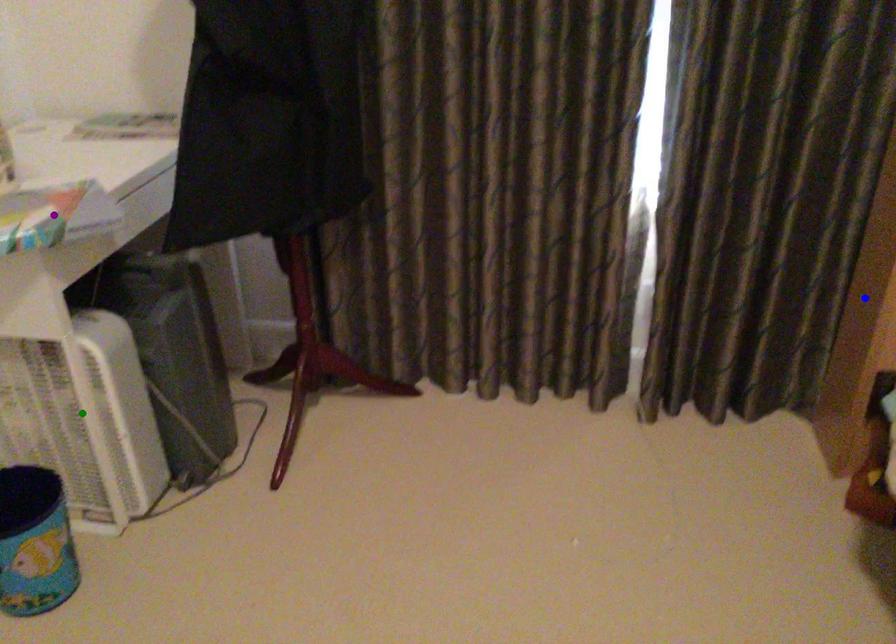
Order these from nearest to farthest:
- green point
- blue point
- purple point

1. purple point
2. green point
3. blue point